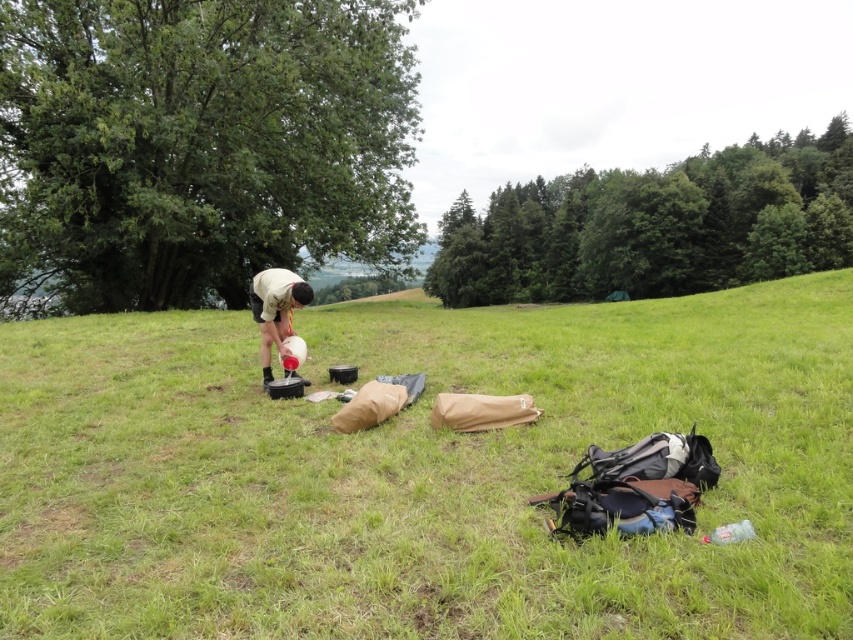
Who is higher up, green grassy field at center or white matte shirt at center?

green grassy field at center is above.

Can you confirm if green grassy field at center is thinner than white matte shirt at center?

No.

What do you see at coordinates (422, 472) in the screenshot? This screenshot has width=853, height=640. I see `green grassy field at center` at bounding box center [422, 472].

The height and width of the screenshot is (640, 853). I want to click on green grassy field at center, so click(422, 472).